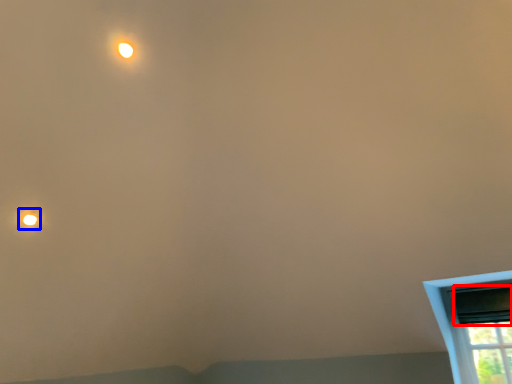
Question: Which object appears closest to the camera in this image, window screen (highlighted by a red box) or droplight (highlighted by a blue box)?

Choices:
 (A) window screen
 (B) droplight

Answer: (B)